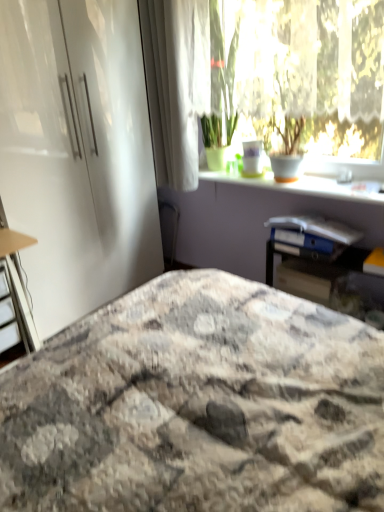
Measure the distance between point (343,165) and camera.

Point (343,165) is 2.13 meters from camera.

Locate an element on the screen. wooden table at right is located at coordinates (323, 275).

What do you see at coordinates (323, 275) in the screenshot? I see `wooden table at right` at bounding box center [323, 275].

The image size is (384, 512). I want to click on matte white desk at left, so click(19, 285).

Consider the image. Which object is closer to the camera taking this photo, matte white desk at left or transparent glass window at upper center?

transparent glass window at upper center is closer to the camera.

Does point (33, 349) come behind point (383, 34)?

Yes, it is.

Considering the relative sizes of matte white desk at left and transparent glass window at upper center in the image provided, is matte white desk at left taller than transparent glass window at upper center?

No, matte white desk at left is not taller than transparent glass window at upper center.

Where is `window in front of the matte white desk at left`? The height and width of the screenshot is (512, 384). window in front of the matte white desk at left is located at coordinates (313, 76).

Is white glossy cabinet at left looking in the opposite direction of matte white desk at left?

No, white glossy cabinet at left is not facing the opposite direction of matte white desk at left.

Is white glossy cabinet at left shorter than matte white desk at left?

No, white glossy cabinet at left is not shorter than matte white desk at left.

Which object is wider, white fabric curtain at upper left or transparent glass window at upper center?

transparent glass window at upper center is wider.

Where is `window on the right of white fabric curtain at upper left`? window on the right of white fabric curtain at upper left is located at coordinates (313, 76).

Between white fabric curtain at upper left and transparent glass window at upper center, which one has more height?

Standing taller between the two is transparent glass window at upper center.

The image size is (384, 512). Find the location of `window sill above the matte white desk at left (from a real-world perspective)`. window sill above the matte white desk at left (from a real-world perspective) is located at coordinates (306, 185).

Considering their positions, is matte white desk at left located in front of or behind white glossy window sill at upper center?

In the image, matte white desk at left appears behind white glossy window sill at upper center.

Which of these two, matte white desk at left or white glossy window sill at upper center, is bigger?

With larger size is matte white desk at left.

Looking at their sizes, would you say matte white desk at left is wider or thinner than white glossy window sill at upper center?

Considering their sizes, matte white desk at left looks broader than white glossy window sill at upper center.

In terms of height, does white glossy cabinet at left look taller or shorter compared to white glossy window sill at upper center?

Clearly, white glossy cabinet at left is taller compared to white glossy window sill at upper center.

Is white glossy cabinet at left at the left side of white glossy window sill at upper center?

Indeed, white glossy cabinet at left is positioned on the left side of white glossy window sill at upper center.

Is the depth of white glossy cabinet at left greater than that of white glossy window sill at upper center?

That is False.

Can you confirm if matte white desk at left is wider than white fabric curtain at upper left?

Yes, matte white desk at left is wider than white fabric curtain at upper left.

Is matte white desk at left outside of white fabric curtain at upper left?

Yes.

Between point (6, 252) and point (163, 20), which one is positioned behind?

Positioned behind is point (163, 20).

Could you tell me if matte white desk at left is facing white fabric curtain at upper left?

No, matte white desk at left is not aimed at white fabric curtain at upper left.

Are white fabric curtain at upper left and matte white desk at left far apart?

That's right, there is a large distance between white fabric curtain at upper left and matte white desk at left.

Is white fabric curtain at upper left completely or partially outside of matte white desk at left?

Yes, white fabric curtain at upper left is not within matte white desk at left.

Which object is further away from the camera, white fabric curtain at upper left or matte white desk at left?

matte white desk at left is further from the camera.

The image size is (384, 512). I want to click on window that appears above the matte white desk at left (from a real-world perspective), so (x=313, y=76).

Locate an element on the screen. This screenshot has width=384, height=512. desk located behind the white glossy cabinet at left is located at coordinates (19, 285).

Which object lies further to the anchor point wooden table at right, white fabric curtain at upper left or transparent glass window at upper center?

white fabric curtain at upper left is further to wooden table at right.

From the image, which object appears to be farther from white fabric curtain at upper left, transparent glass window at upper center or white glossy cabinet at left?

white glossy cabinet at left is further to white fabric curtain at upper left.

From the image, which object appears to be nearer to white fabric curtain at upper left, marble-patterned bedspread at center or wooden table at right?

The object closer to white fabric curtain at upper left is wooden table at right.

Considering their positions, is wooden table at right positioned closer to marble-patterned bedspread at center than white glossy cabinet at left?

wooden table at right is closer to marble-patterned bedspread at center.

Which object lies nearer to the anchor point white glossy window sill at upper center, white glossy cabinet at left or wooden table at right?

wooden table at right lies closer to white glossy window sill at upper center than the other object.

Estimate the real-world distances between objects in this image. Which object is closer to matte white desk at left, marble-patterned bedspread at center or white glossy window sill at upper center?

Based on the image, marble-patterned bedspread at center appears to be nearer to matte white desk at left.

Which object lies nearer to the anchor point marble-patterned bedspread at center, wooden table at right or white fabric curtain at upper left?

wooden table at right is closer to marble-patterned bedspread at center.

Based on their spatial positions, is white glossy window sill at upper center or marble-patterned bedspread at center further from matte white desk at left?

white glossy window sill at upper center is positioned further to the anchor matte white desk at left.

Where is `screen door located between matte white desk at left and white glossy window sill at upper center in the left-right direction`? This screenshot has width=384, height=512. screen door located between matte white desk at left and white glossy window sill at upper center in the left-right direction is located at coordinates (77, 153).

The width and height of the screenshot is (384, 512). Find the location of `window between white glossy cabinet at left and white glossy window sill at upper center from left to right`. window between white glossy cabinet at left and white glossy window sill at upper center from left to right is located at coordinates (313, 76).

At what (x,y) coordinates should I click in order to perform the action: click on window sill situated between matte white desk at left and wooden table at right from left to right. Please return your answer as a coordinate pair (x, y). The image size is (384, 512). Looking at the image, I should click on (306, 185).

This screenshot has height=512, width=384. I want to click on curtain between white glossy cabinet at left and wooden table at right in the horizontal direction, so click(171, 89).